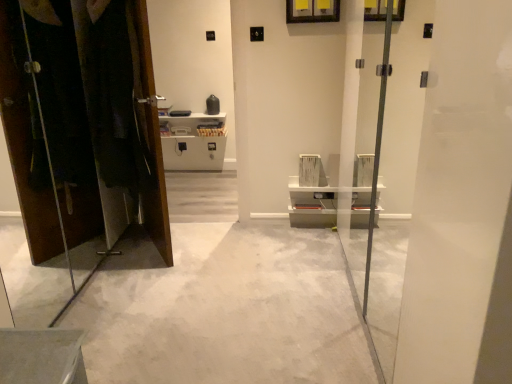
Question: Considering their positions, is transparent glass screen door at center located in front of or behind dark fabric laundry at left?

Choices:
 (A) behind
 (B) front

Answer: (B)

Question: In the image, is transparent glass screen door at center on the left side or the right side of dark fabric laundry at left?

Choices:
 (A) right
 (B) left

Answer: (A)

Question: Which is farther from the dark fabric laundry at left?

Choices:
 (A) transparent glass screen door at center
 (B) white concrete floor at center
 (C) matte brown dresser at left

Answer: (A)

Question: Estimate the real-world distances between objects in this image. Which object is farther from the transparent glass screen door at center?

Choices:
 (A) matte brown dresser at left
 (B) white concrete floor at center
 (C) dark fabric laundry at left

Answer: (A)